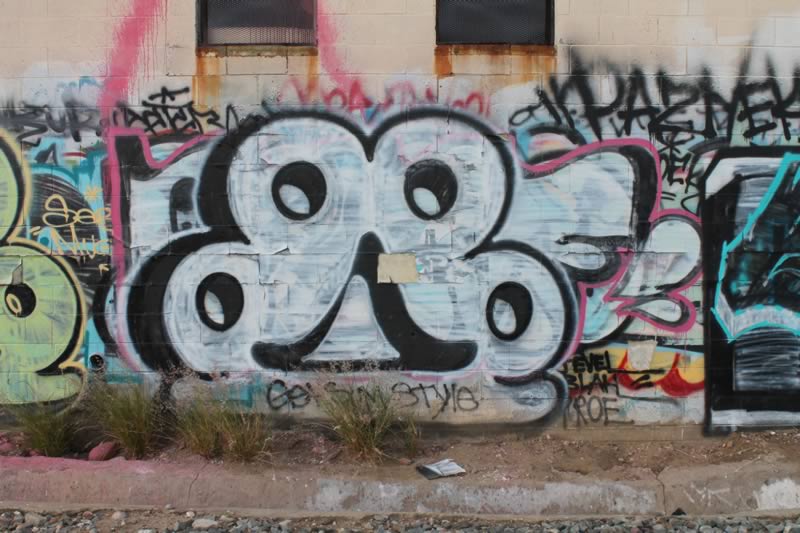
The width and height of the screenshot is (800, 533). I want to click on window, so click(268, 17), click(517, 21).